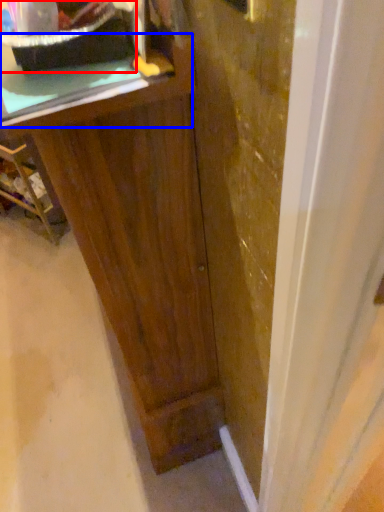
Question: Which point is further to the camera, appliance (highlighted by a red box) or counter top (highlighted by a blue box)?

Choices:
 (A) appliance
 (B) counter top

Answer: (B)